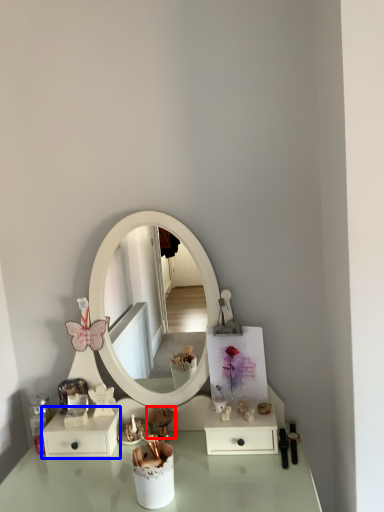
Question: Which point is further to the camera, toy (highlighted by a red box) or dresser (highlighted by a blue box)?

Choices:
 (A) toy
 (B) dresser

Answer: (A)